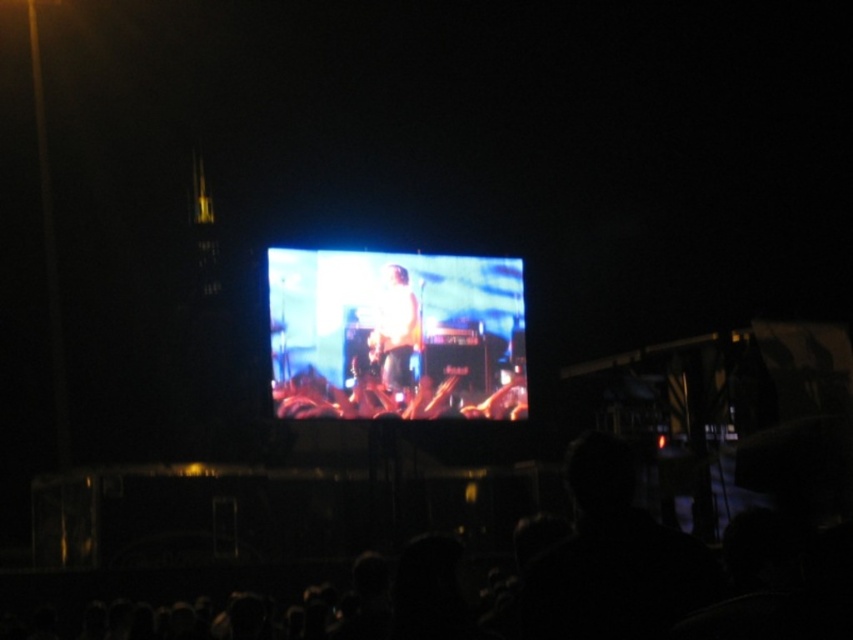
Can you confirm if black matte crowd at lower center is positioned above shiny silver phone at center?

Actually, black matte crowd at lower center is below shiny silver phone at center.

Does black matte crowd at lower center have a greater height compared to shiny silver phone at center?

Yes, black matte crowd at lower center is taller than shiny silver phone at center.

What do you see at coordinates (401, 548) in the screenshot? I see `black matte crowd at lower center` at bounding box center [401, 548].

Find the location of a particular element. The height and width of the screenshot is (640, 853). black matte crowd at lower center is located at coordinates (401, 548).

Can you confirm if shiny silver phone at center is wider than white matte shirt at center?

Yes.

Which is in front, point (292, 328) or point (416, 310)?

Point (292, 328)

Locate an element on the screen. shiny silver phone at center is located at coordinates (395, 333).

Measure the distance between point (366, 509) and camera.

Point (366, 509) is 79.23 meters from camera.

Between black matte crowd at lower center and white matte shirt at center, which one has less height?

white matte shirt at center

Who is more forward, (294, 484) or (404, 305)?

Point (294, 484) is in front.

Find the location of a particular element. This screenshot has height=640, width=853. black matte crowd at lower center is located at coordinates (401, 548).